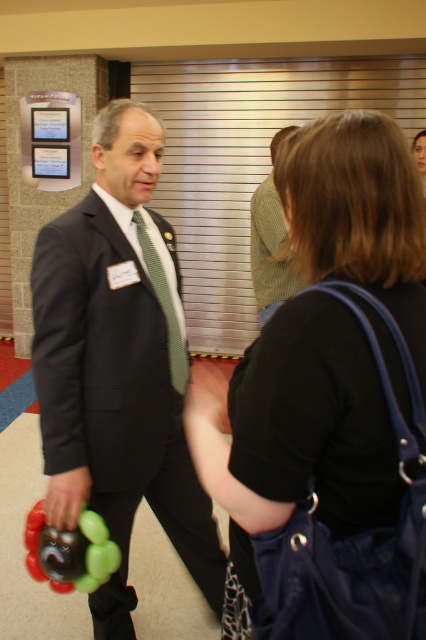
Consider the image. Is green knitted sweater at center wider than green checkered tie at center?

Yes, green knitted sweater at center is wider than green checkered tie at center.

Consider the image. Is green knitted sweater at center to the left of green checkered tie at center from the viewer's perspective?

In fact, green knitted sweater at center is to the right of green checkered tie at center.

At what (x,y) coordinates should I click in order to perform the action: click on green knitted sweater at center. Please return your answer as a coordinate pair (x, y). This screenshot has width=426, height=640. Looking at the image, I should click on (270, 252).

Is matte black suit at center smaller than green knitted sweater at center?

No, matte black suit at center is not smaller than green knitted sweater at center.

Which is behind, point (161, 493) or point (281, 211)?

The point (281, 211) is more distant.

The image size is (426, 640). Find the location of `matte black suit at center`. matte black suit at center is located at coordinates (118, 365).

Between black fabric purse at center and matte black suit at center, which one appears on the left side from the viewer's perspective?

Positioned to the left is matte black suit at center.

Is black fabric purse at center smaller than matte black suit at center?

Correct, black fabric purse at center occupies less space than matte black suit at center.

At what (x,y) coordinates should I click in order to perform the action: click on black fabric purse at center. Please return your answer as a coordinate pair (x, y). Image resolution: width=426 pixels, height=640 pixels. Looking at the image, I should click on (331, 403).